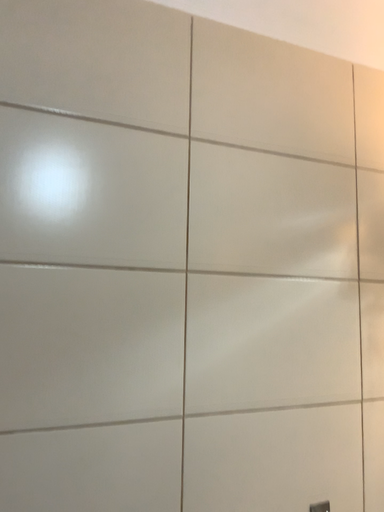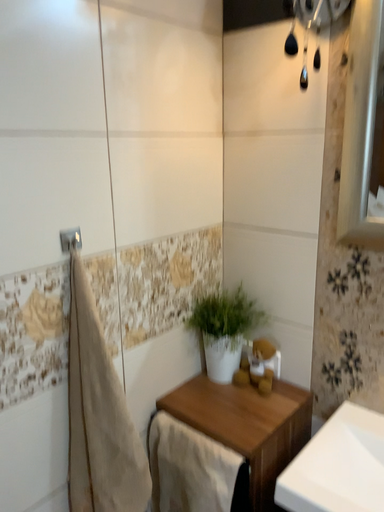
Question: How did the camera likely rotate when shooting the video?

Choices:
 (A) rotated downward
 (B) rotated upward

Answer: (A)